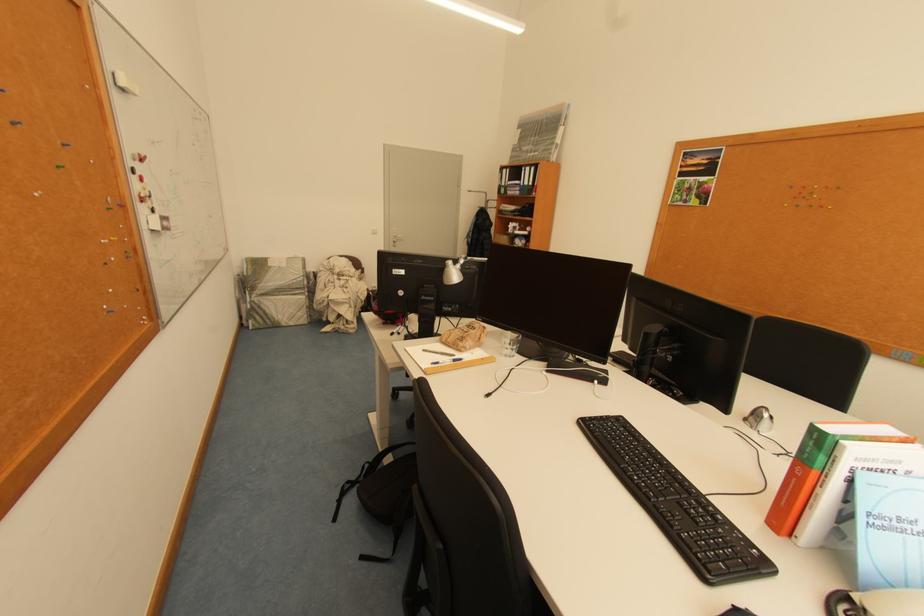
The width and height of the screenshot is (924, 616). Describe the element at coordinates (759, 419) in the screenshot. I see `the silver lamp head` at that location.